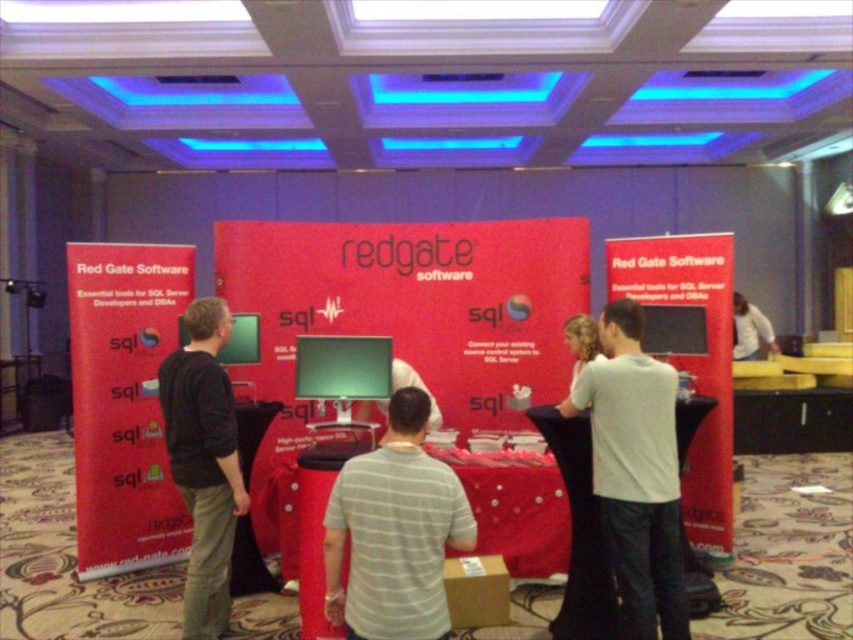
Is gray striped shirt at center thinner than black cotton shirt at left?

No.

Does gray striped shirt at center have a lesser height compared to black cotton shirt at left?

Indeed, gray striped shirt at center has a lesser height compared to black cotton shirt at left.

Locate an element on the screen. This screenshot has height=640, width=853. gray striped shirt at center is located at coordinates (393, 532).

Does white cotton shirt at center have a smaller size compared to white fabric at center?

Yes, white cotton shirt at center is smaller than white fabric at center.

Does white cotton shirt at center have a lesser width compared to white fabric at center?

Yes, white cotton shirt at center is thinner than white fabric at center.

Between point (677, 593) and point (735, 324), which one is positioned behind?

The point (735, 324) is behind.

The height and width of the screenshot is (640, 853). In order to click on white cotton shirt at center in this screenshot , I will do `click(635, 472)`.

Can you confirm if black cotton shirt at left is positioned to the left of white fabric at center?

Correct, you'll find black cotton shirt at left to the left of white fabric at center.

Which is behind, point (192, 330) or point (750, 346)?

The point (750, 346) is behind.

At what (x,y) coordinates should I click in order to perform the action: click on black cotton shirt at left. Please return your answer as a coordinate pair (x, y). Looking at the image, I should click on (204, 461).